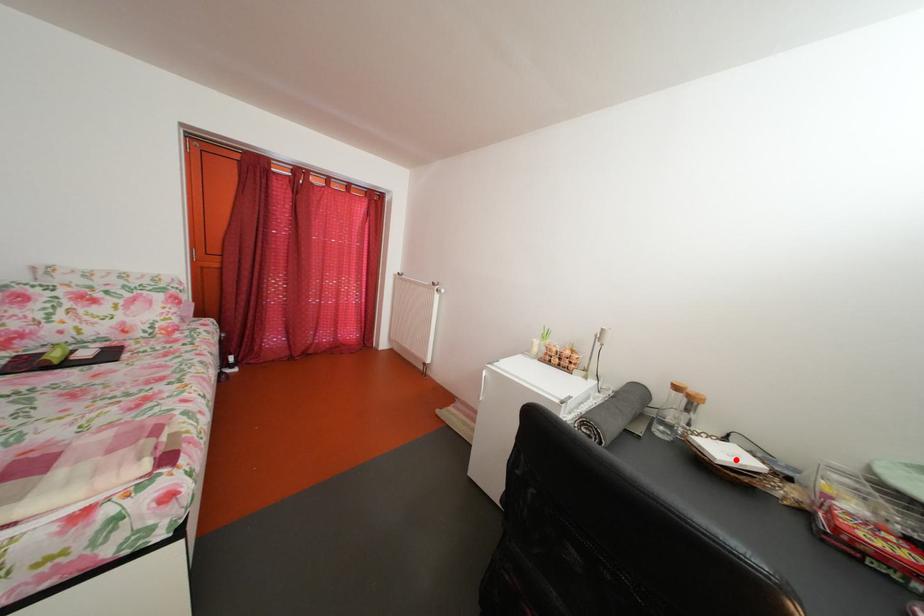
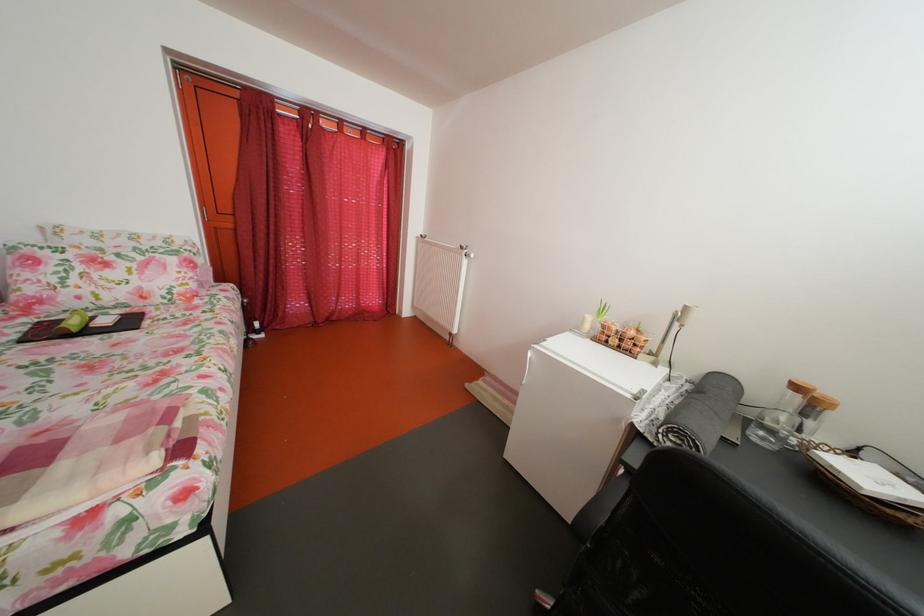
Locate, in the second image, the point that corresponds to the highlighted location in the first image.

(880, 485)